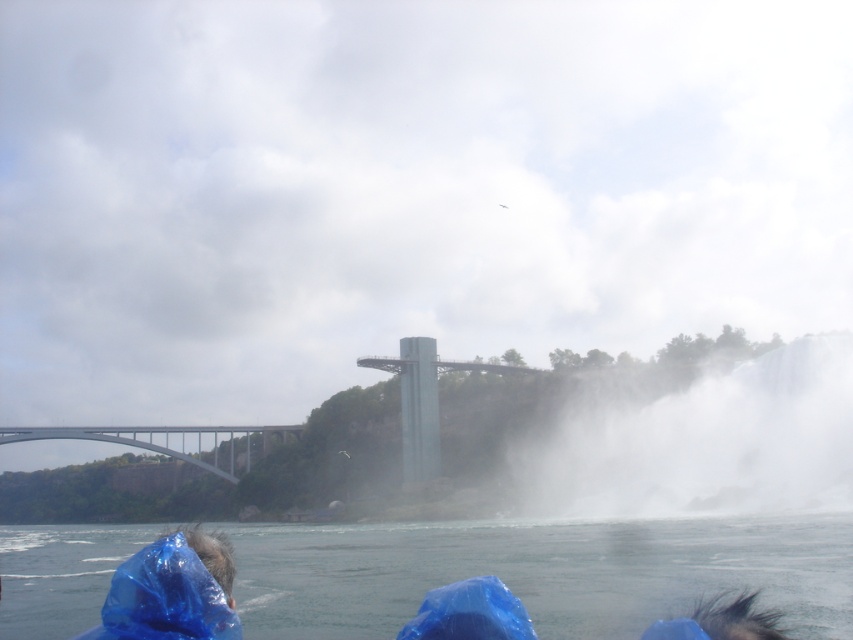
Question: Does transparent plastic water at lower center appear on the right side of white mist at lower right?

Choices:
 (A) yes
 (B) no

Answer: (B)

Question: Estimate the real-world distances between objects in this image. Which object is farther from the white mist at lower right?

Choices:
 (A) concrete bridge at lower left
 (B) blue plastic bag at lower left

Answer: (A)

Question: Among these points, which one is nearest to the camera?

Choices:
 (A) (640, 550)
 (B) (219, 536)
 (C) (534, 515)

Answer: (B)

Question: Is transparent plastic water at lower center bigger than white mist at lower right?

Choices:
 (A) no
 (B) yes

Answer: (B)

Question: Considering the relative positions of transparent plastic water at lower center and white mist at lower right in the image provided, where is transparent plastic water at lower center located with respect to white mist at lower right?

Choices:
 (A) right
 (B) left

Answer: (B)

Question: Which object appears farthest from the camera in this image?

Choices:
 (A) white mist at lower right
 (B) transparent plastic water at lower center
 (C) concrete bridge at lower left

Answer: (C)